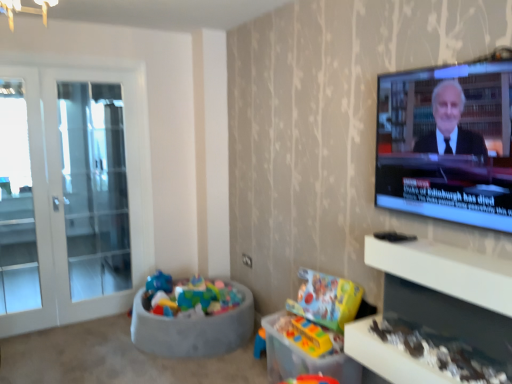
Question: Is point (492, 105) positioned closer to the camera than point (444, 271)?

Choices:
 (A) farther
 (B) closer

Answer: (B)

Question: Is matte black tv at upper right inside the boundaries of white glossy entertainment center at lower right, or outside?

Choices:
 (A) outside
 (B) inside

Answer: (A)

Question: Which of these objects is positioned closest to the matte black tv at upper right?

Choices:
 (A) white glass door at left
 (B) white glossy entertainment center at lower right
 (C) multicolored fabric bean bag at lower left

Answer: (B)

Question: Which is nearer to the matte black tv at upper right?

Choices:
 (A) white glossy entertainment center at lower right
 (B) white glass door at left
 (C) multicolored fabric bean bag at lower left

Answer: (A)